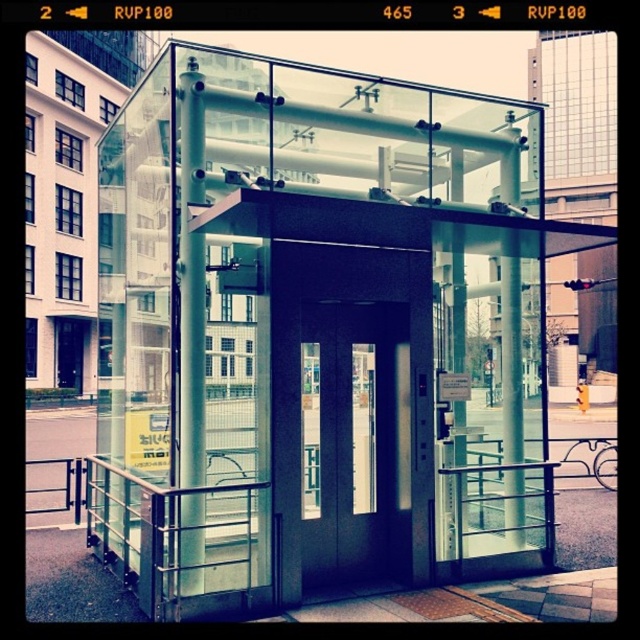
Question: Considering the relative positions of metallic silver pole at center and clear glass pillar at center in the image provided, where is metallic silver pole at center located with respect to clear glass pillar at center?

Choices:
 (A) below
 (B) above

Answer: (B)

Question: Is the position of metallic silver pole at center less distant than that of clear glass pillar at center?

Choices:
 (A) no
 (B) yes

Answer: (B)

Question: Is transparent glass door at center closer to the viewer compared to clear glass pillar at center?

Choices:
 (A) yes
 (B) no

Answer: (A)

Question: Which point is closer to the camera taking this photo?

Choices:
 (A) coord(516,538)
 (B) coord(276,104)
 (C) coord(195,381)
 (D) coord(372,547)

Answer: (C)

Question: Which is farther from the transparent glass door at center?

Choices:
 (A) metallic silver pole at center
 (B) clear glass pillar at center

Answer: (B)

Question: Which object is closer to the camera taking this photo?

Choices:
 (A) transparent glass elevator at center
 (B) clear glass pillar at center

Answer: (A)